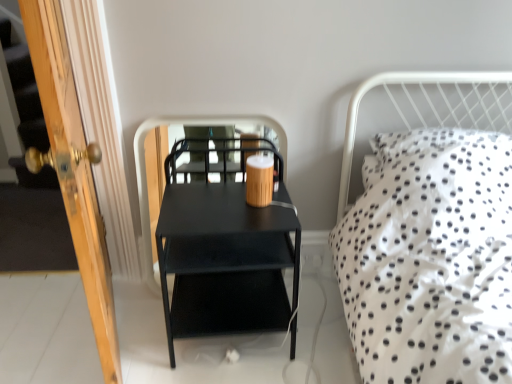
Image resolution: width=512 pixels, height=384 pixels. Identify the location of vacant space in wooden door at left (from a real-world perspective). (121, 330).